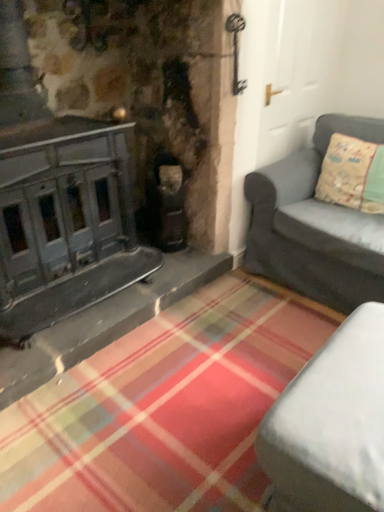
Image resolution: width=384 pixels, height=512 pixels. What do you see at coordinates (352, 174) in the screenshot? I see `light green fabric pillow at right` at bounding box center [352, 174].

Describe the element at coordinates (331, 424) in the screenshot. I see `white fabric studio couch at lower right, marked as the 1th studio couch in a bottom-to-top arrangement` at that location.

Identify the location of light green fabric pillow at right. The image size is (384, 512). point(352,174).

Is matte gray couch at right, placed as the first studio couch when sorted from top to bottom, located within white fabric studio couch at lower right, which appears as the second studio couch when viewed from the back?

No, white fabric studio couch at lower right, which appears as the second studio couch when viewed from the back, does not contain matte gray couch at right, placed as the first studio couch when sorted from top to bottom.

In terms of size, does white fabric studio couch at lower right, which is counted as the second studio couch, starting from the top, appear bigger or smaller than matte gray couch at right, placed as the first studio couch when sorted from top to bottom?

In the image, white fabric studio couch at lower right, which is counted as the second studio couch, starting from the top, appears to be smaller than matte gray couch at right, placed as the first studio couch when sorted from top to bottom.

What's the angular difference between white fabric studio couch at lower right, positioned as the first studio couch in front-to-back order, and matte gray couch at right, which is counted as the second studio couch, starting from the bottom,'s facing directions?

87.4 degrees.

Does white fabric studio couch at lower right, positioned as the first studio couch in front-to-back order, appear on the right side of matte gray couch at right, which is the second studio couch in front-to-back order?

No.

Is light green fabric pillow at right taller or shorter than white fabric studio couch at lower right, marked as the 1th studio couch in a bottom-to-top arrangement?

Clearly, light green fabric pillow at right is taller compared to white fabric studio couch at lower right, marked as the 1th studio couch in a bottom-to-top arrangement.

How far apart are light green fabric pillow at right and white fabric studio couch at lower right, which is counted as the second studio couch, starting from the top?

They are 1.23 meters apart.

In terms of size, does light green fabric pillow at right appear bigger or smaller than white fabric studio couch at lower right, which is counted as the second studio couch, starting from the top?

In the image, light green fabric pillow at right appears to be smaller than white fabric studio couch at lower right, which is counted as the second studio couch, starting from the top.

How different are the orientations of light green fabric pillow at right and white fabric studio couch at lower right, which appears as the second studio couch when viewed from the back, in degrees?

The facing directions of light green fabric pillow at right and white fabric studio couch at lower right, which appears as the second studio couch when viewed from the back, are 93.3 degrees apart.

Between matte gray couch at right, placed as the first studio couch when sorted from top to bottom, and white fabric studio couch at lower right, which is counted as the second studio couch, starting from the top, which one appears on the right side from the viewer's perspective?

Positioned to the right is matte gray couch at right, placed as the first studio couch when sorted from top to bottom.

Is matte gray couch at right, which is the second studio couch in front-to-back order, aimed at white fabric studio couch at lower right, positioned as the first studio couch in front-to-back order?

Yes, matte gray couch at right, which is the second studio couch in front-to-back order, is turned towards white fabric studio couch at lower right, positioned as the first studio couch in front-to-back order.

Identify the location of studio couch behind the white fabric studio couch at lower right, marked as the 1th studio couch in a bottom-to-top arrangement. (315, 225).

Can you confirm if matte gray couch at right, the 1th studio couch when ordered from back to front, is smaller than white fabric studio couch at lower right, which appears as the second studio couch when viewed from the back?

Actually, matte gray couch at right, the 1th studio couch when ordered from back to front, might be larger than white fabric studio couch at lower right, which appears as the second studio couch when viewed from the back.

Between matte gray couch at right, which is counted as the second studio couch, starting from the bottom, and light green fabric pillow at right, which one is positioned behind?

light green fabric pillow at right is behind.

Could you tell me if matte gray couch at right, the 1th studio couch when ordered from back to front, is turned towards light green fabric pillow at right?

Yes, matte gray couch at right, the 1th studio couch when ordered from back to front, faces towards light green fabric pillow at right.

Does matte gray couch at right, the 1th studio couch when ordered from back to front, have a larger size compared to light green fabric pillow at right?

Correct, matte gray couch at right, the 1th studio couch when ordered from back to front, is larger in size than light green fabric pillow at right.

Considering the sizes of white fabric studio couch at lower right, which is counted as the second studio couch, starting from the top, and light green fabric pillow at right in the image, is white fabric studio couch at lower right, which is counted as the second studio couch, starting from the top, bigger or smaller than light green fabric pillow at right?

Clearly, white fabric studio couch at lower right, which is counted as the second studio couch, starting from the top, is larger in size than light green fabric pillow at right.

What's the angular difference between white fabric studio couch at lower right, which is counted as the second studio couch, starting from the top, and light green fabric pillow at right's facing directions?

93.3 degrees.

From a real-world perspective, is white fabric studio couch at lower right, positioned as the first studio couch in front-to-back order, above or below light green fabric pillow at right?

From a real-world perspective, white fabric studio couch at lower right, positioned as the first studio couch in front-to-back order, is physically below light green fabric pillow at right.

Which of these two, white fabric studio couch at lower right, marked as the 1th studio couch in a bottom-to-top arrangement, or light green fabric pillow at right, stands taller?

light green fabric pillow at right.

Would you consider light green fabric pillow at right to be distant from matte gray couch at right, which is the second studio couch in front-to-back order?

No, light green fabric pillow at right is in close proximity to matte gray couch at right, which is the second studio couch in front-to-back order.

From a real-world perspective, is light green fabric pillow at right over matte gray couch at right, which is counted as the second studio couch, starting from the bottom?

Yes.

Is light green fabric pillow at right at the left side of matte gray couch at right, which is counted as the second studio couch, starting from the bottom?

No, light green fabric pillow at right is not to the left of matte gray couch at right, which is counted as the second studio couch, starting from the bottom.

You are a GUI agent. You are given a task and a screenshot of the screen. Output one action in this format:
    pyautogui.click(x=<x>, y=<y>)
    Task: Click on the studio couch that appears above the white fabric studio couch at lower right, positioned as the first studio couch in front-to-back order (from a real-world perspective)
    
    Given the screenshot: What is the action you would take?
    pyautogui.click(x=315, y=225)

From a real-world perspective, starting from the light green fabric pillow at right, which studio couch is the 2nd one below it? Please provide its 2D coordinates.

[(331, 424)]

From the image, which object appears to be nearer to matte gray couch at right, which is counted as the second studio couch, starting from the bottom, white fabric studio couch at lower right, marked as the 1th studio couch in a bottom-to-top arrangement, or light green fabric pillow at right?

Based on the image, light green fabric pillow at right appears to be nearer to matte gray couch at right, which is counted as the second studio couch, starting from the bottom.

When comparing their distances from matte gray couch at right, placed as the first studio couch when sorted from top to bottom, does light green fabric pillow at right or white fabric studio couch at lower right, marked as the 1th studio couch in a bottom-to-top arrangement, seem closer?

The object closer to matte gray couch at right, placed as the first studio couch when sorted from top to bottom, is light green fabric pillow at right.

Estimate the real-world distances between objects in this image. Which object is closer to white fabric studio couch at lower right, which is counted as the second studio couch, starting from the top, matte gray couch at right, which is the second studio couch in front-to-back order, or light green fabric pillow at right?

Among the two, matte gray couch at right, which is the second studio couch in front-to-back order, is located nearer to white fabric studio couch at lower right, which is counted as the second studio couch, starting from the top.

From the picture: Which object lies further to the anchor point white fabric studio couch at lower right, which is counted as the second studio couch, starting from the top, light green fabric pillow at right or matte gray couch at right, placed as the first studio couch when sorted from top to bottom?

light green fabric pillow at right is positioned further to the anchor white fabric studio couch at lower right, which is counted as the second studio couch, starting from the top.

When comparing their distances from light green fabric pillow at right, does white fabric studio couch at lower right, positioned as the first studio couch in front-to-back order, or matte gray couch at right, placed as the first studio couch when sorted from top to bottom, seem further?

white fabric studio couch at lower right, positioned as the first studio couch in front-to-back order.

When comparing their distances from light green fabric pillow at right, does matte gray couch at right, the 1th studio couch when ordered from back to front, or white fabric studio couch at lower right, which appears as the second studio couch when viewed from the back, seem further?

Based on the image, white fabric studio couch at lower right, which appears as the second studio couch when viewed from the back, appears to be further to light green fabric pillow at right.

This screenshot has height=512, width=384. What are the coordinates of `studio couch between white fabric studio couch at lower right, which is counted as the second studio couch, starting from the top, and light green fabric pillow at right, along the z-axis` in the screenshot? It's located at (315, 225).